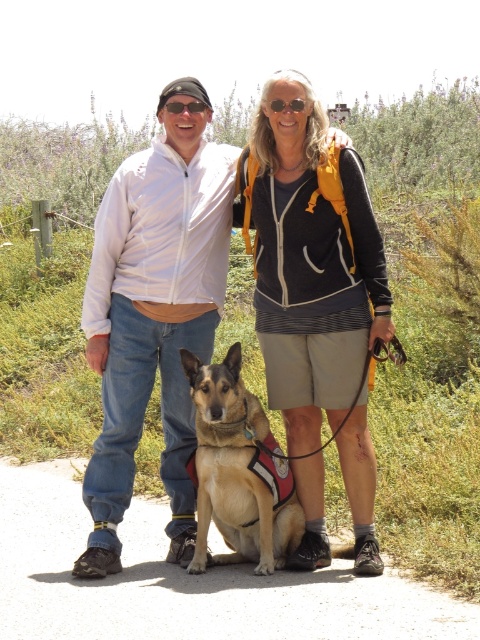
Between point (332, 426) and point (196, 104), which one is positioned in front?

Point (332, 426) is more forward.

Can you confirm if matte gray hoodie at center is thinner than black plastic goggles at center?

In fact, matte gray hoodie at center might be wider than black plastic goggles at center.

Find the location of a particular element. This screenshot has height=640, width=480. matte gray hoodie at center is located at coordinates (310, 266).

At what (x,y) coordinates should I click in order to perform the action: click on matte gray hoodie at center. Please return your answer as a coordinate pair (x, y). The height and width of the screenshot is (640, 480). Looking at the image, I should click on (310, 266).

Can you confirm if brown fur dog at center is taller than black plastic goggles at center?

Indeed, brown fur dog at center has a greater height compared to black plastic goggles at center.

Is point (248, 464) more distant than point (192, 112)?

No, (248, 464) is in front of (192, 112).

The image size is (480, 640). In order to click on brown fur dog at center in this screenshot , I will do `click(239, 470)`.

Who is shorter, sunglasses at center or black plastic goggles at center?

Standing shorter between the two is sunglasses at center.

Where is `sunglasses at center`? This screenshot has width=480, height=640. sunglasses at center is located at coordinates 288,104.

I want to click on sunglasses at center, so click(x=288, y=104).